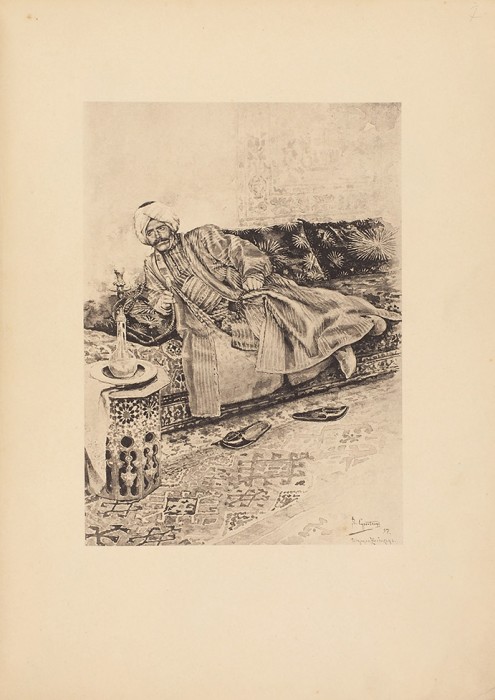
Identify the location of man's slippers on rug in front of sofa, center. click(338, 413), click(244, 441).